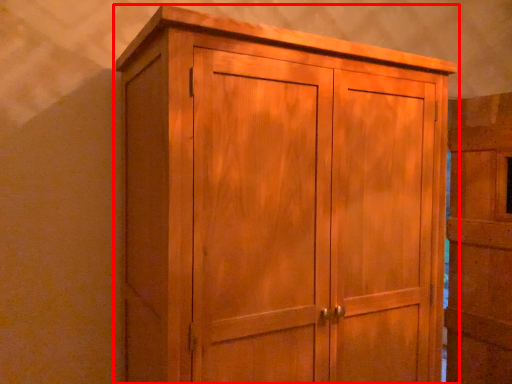
Question: From the image's perspective, considering the relative positions of cupboard (annotated by the red box) and door in the image provided, where is cupboard (annotated by the red box) located with respect to the staircase?

Choices:
 (A) below
 (B) above

Answer: (B)